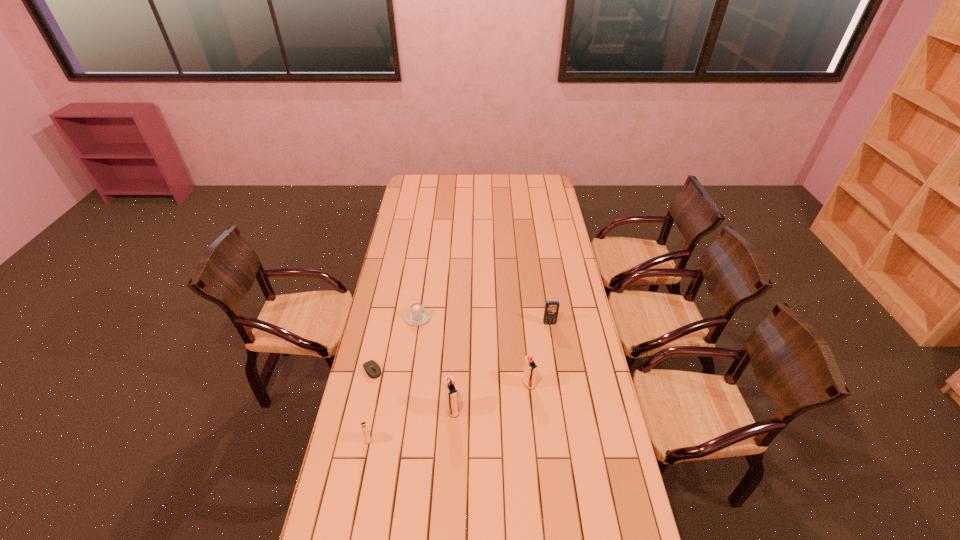
Where is `free spot located on the front of the shortest igniter`? This screenshot has height=540, width=960. free spot located on the front of the shortest igniter is located at coordinates (352, 516).

Find the location of a particular element. This screenshot has width=960, height=540. vacant space situated on the right of the second farthest igniter is located at coordinates (506, 410).

Image resolution: width=960 pixels, height=540 pixels. I want to click on free point located 0.060m on the right of the rightmost igniter, so click(x=550, y=384).

Where is `free point located to the right of the second shortest object`? Image resolution: width=960 pixels, height=540 pixels. free point located to the right of the second shortest object is located at coordinates (425, 264).

Where is `free space located 0.240m to the right of the second shortest object`? This screenshot has width=960, height=540. free space located 0.240m to the right of the second shortest object is located at coordinates (424, 273).

Where is `vacant space located 0.110m to the right of the second shortest object`? The image size is (960, 540). vacant space located 0.110m to the right of the second shortest object is located at coordinates (421, 292).

Locate an element on the screen. The image size is (960, 540). free location located 0.150m on the front of the computer equipment is located at coordinates (363, 414).

Where is `vacant space located 0.080m on the screen of the rightmost object`? vacant space located 0.080m on the screen of the rightmost object is located at coordinates (552, 340).

Locate an element on the screen. igniter present at the left edge is located at coordinates (364, 428).

Identify the location of cappuccino situated at the left edge. The width and height of the screenshot is (960, 540). [417, 315].